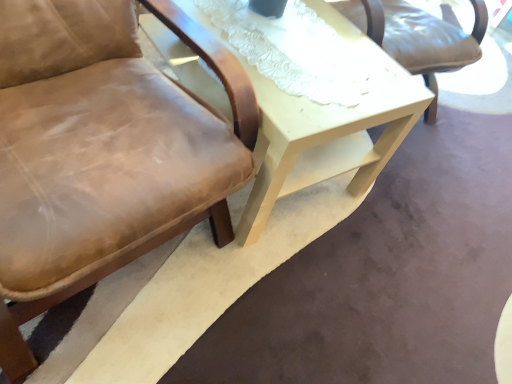
Identify the location of blank space situated above light beige wood table at center (from a real-world perspective). The image size is (512, 384). (298, 41).